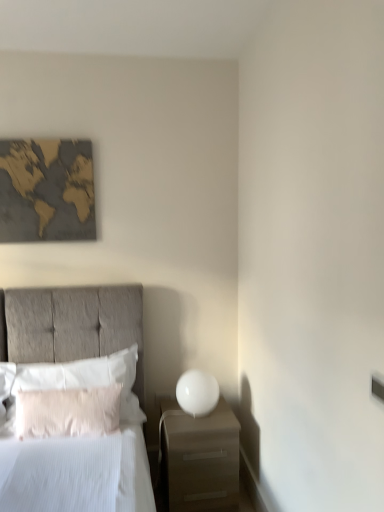
Question: From the image's perspective, is white fluffy pillow at left, acting as the 1th pillow starting from the front, located above or below white soft pillow at left, the 1th pillow from the back?

Choices:
 (A) below
 (B) above

Answer: (A)

Question: From a real-world perspective, is white fluffy pillow at left, which appears as the 2th pillow when viewed from the back, physically located above or below white soft pillow at left, the 1th pillow from the back?

Choices:
 (A) above
 (B) below

Answer: (B)

Question: Estimate the real-world distances between objects in this image. Which object is closer to the matte gray bed at left?

Choices:
 (A) gold textured map at upper left
 (B) white glossy sphere at right
 (C) white soft pillow at left, the 2th pillow when ordered from front to back
 (D) white fluffy pillow at left, which appears as the 2th pillow when viewed from the back
 (E) matte white nightstand at lower right

Answer: (C)

Question: Which object is the farthest from the matte white nightstand at lower right?

Choices:
 (A) white soft pillow at left, the 2th pillow when ordered from front to back
 (B) matte gray bed at left
 (C) white glossy sphere at right
 (D) white fluffy pillow at left, which appears as the 2th pillow when viewed from the back
 (E) gold textured map at upper left

Answer: (E)